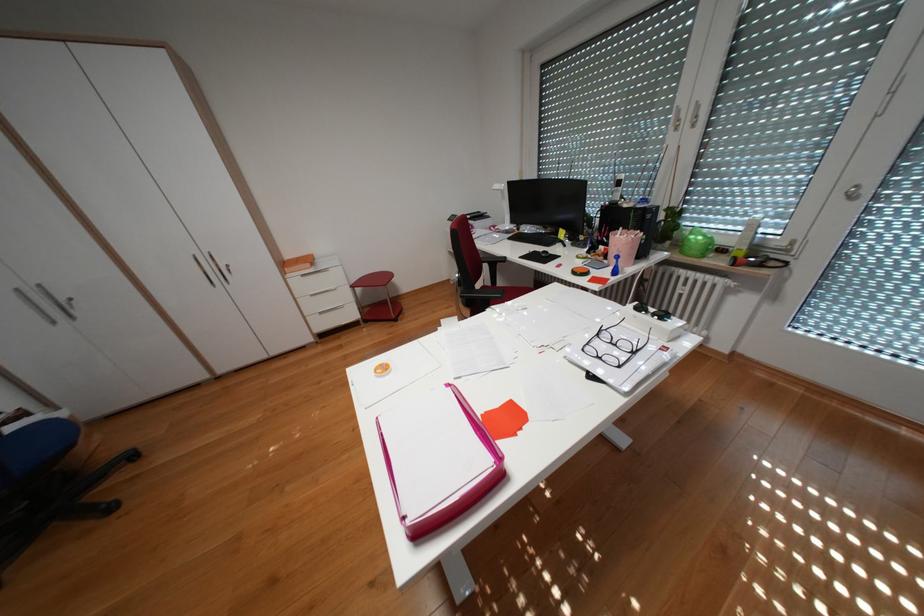
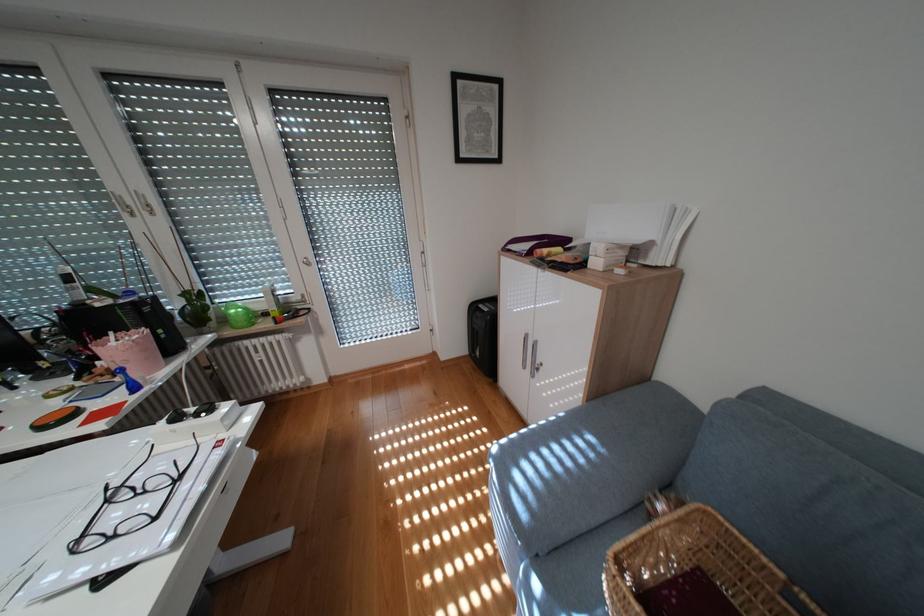
The point at (695, 116) is marked in the first image. Where is the corresponding point in the second image?

(141, 201)